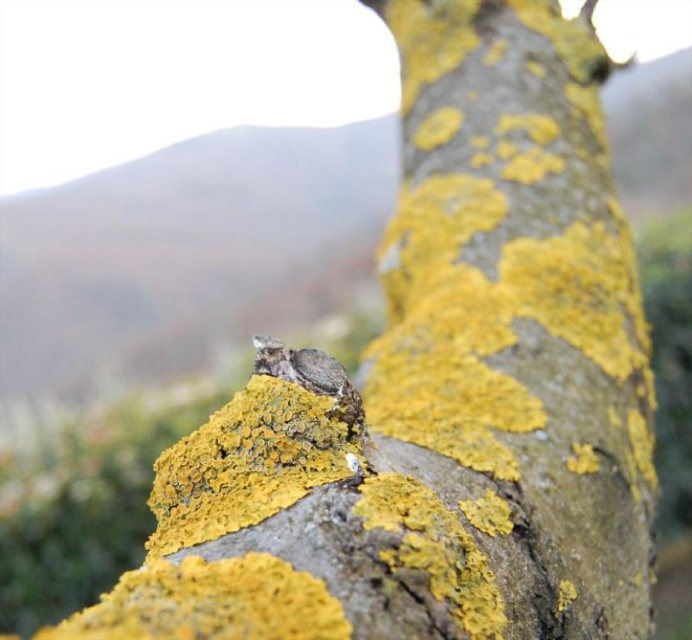
Can you confirm if yellow lichen-covered bark at center is positioned to the left of brown fuzzy bird at upper center?

Incorrect, yellow lichen-covered bark at center is not on the left side of brown fuzzy bird at upper center.

Which is above, yellow lichen-covered bark at center or brown fuzzy bird at upper center?

yellow lichen-covered bark at center is above.

Identify the location of yellow lichen-covered bark at center. (519, 314).